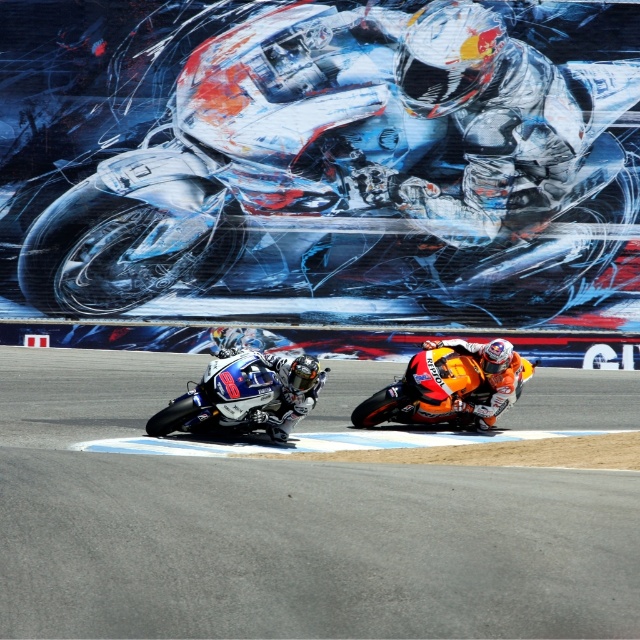
Question: Which object is the farthest from the shiny metallic motorcycle at upper center?

Choices:
 (A) smooth asphalt track at center
 (B) shiny metallic motorcycle at lower left

Answer: (B)

Question: Can you confirm if shiny metallic motorcycle at upper center is positioned to the right of shiny metallic motorcycle at lower left?

Choices:
 (A) yes
 (B) no

Answer: (A)

Question: Which of the following is the closest to the observer?

Choices:
 (A) shiny metallic motorcycle at upper center
 (B) smooth asphalt track at center
 (C) shiny metallic motorcycle at lower left

Answer: (B)

Question: Is the position of shiny metallic motorcycle at upper center more distant than that of shiny metallic motorcycle at lower left?

Choices:
 (A) no
 (B) yes

Answer: (B)

Question: Is shiny metallic motorcycle at upper center to the left of smooth asphalt track at center from the viewer's perspective?

Choices:
 (A) no
 (B) yes

Answer: (B)

Question: Which point is closer to the camera taking this photo?

Choices:
 (A) (12, 448)
 (B) (211, 422)
 (C) (216, 8)

Answer: (A)